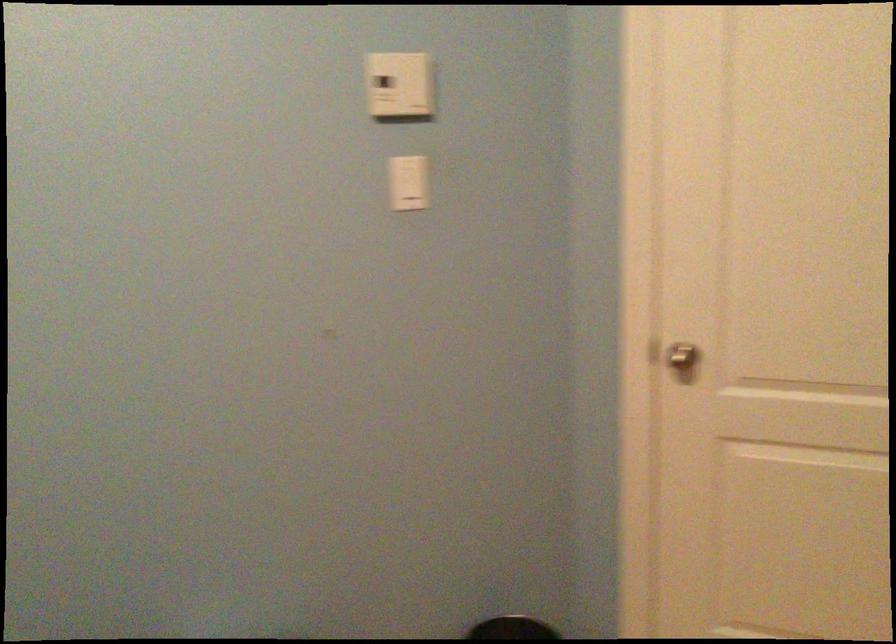
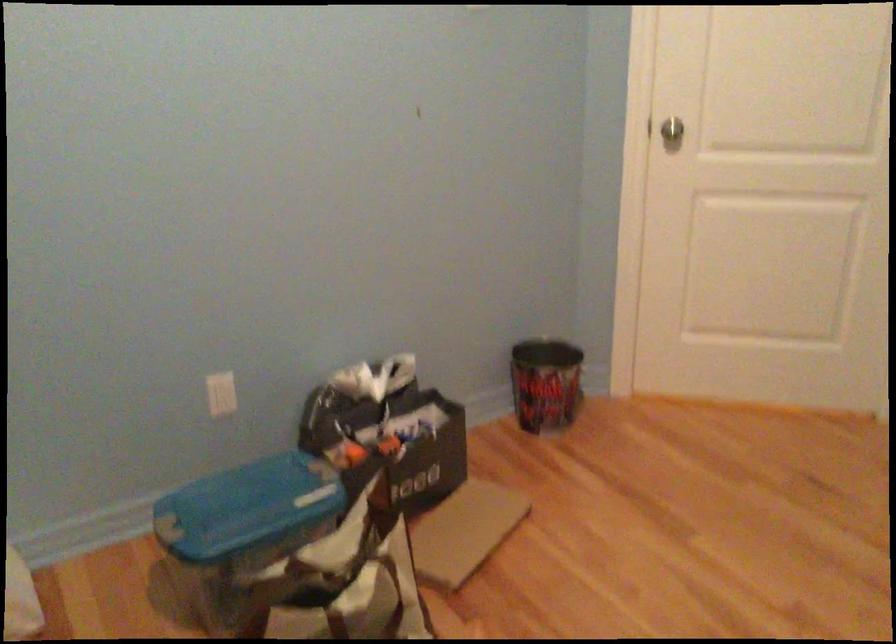
Locate, in the second image, the point that corresponds to point (670, 348) in the first image.

(667, 128)